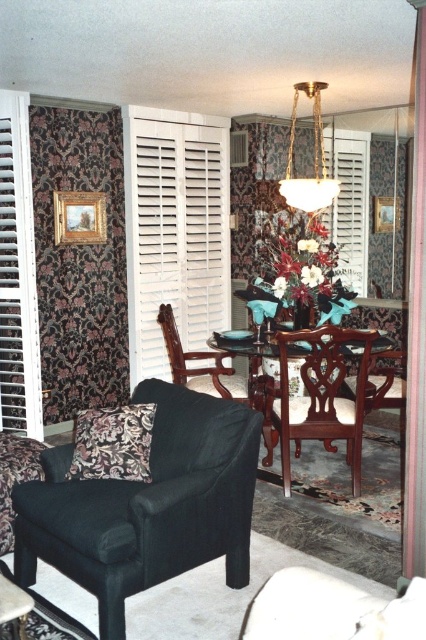
You are planning to move a 1.5 meter wide sofa into the living room. The current space has the white wooden shutter at left and the velvet black couch at lower left. Based on their widths, can the new sofa fit between them?

The white wooden shutter at left has a lesser width compared to the velvet black couch at lower left. Since the new sofa is 1.5 meters wide, but the exact widths of the existing objects aren

You are a guest entering the living room and need to sit down. Which object, the mahogany wood armchair at center or the black leather couch at lower left, would you choose if you prefer a taller seat?

The mahogany wood armchair at center has a greater height compared to the black leather couch at lower left, so you should choose the mahogany wood armchair at center for a taller seat.

You are planning to rearrange the furniture in the living room. You want to place a new rectangular coffee table between the mahogany wood armchair at center and the black leather couch at lower left. The coffee table is 1.2 meters wide. Can the coffee table fit between them?

The mahogany wood armchair at center is wider than the black leather couch at lower left. However, since the exact distance between them isn